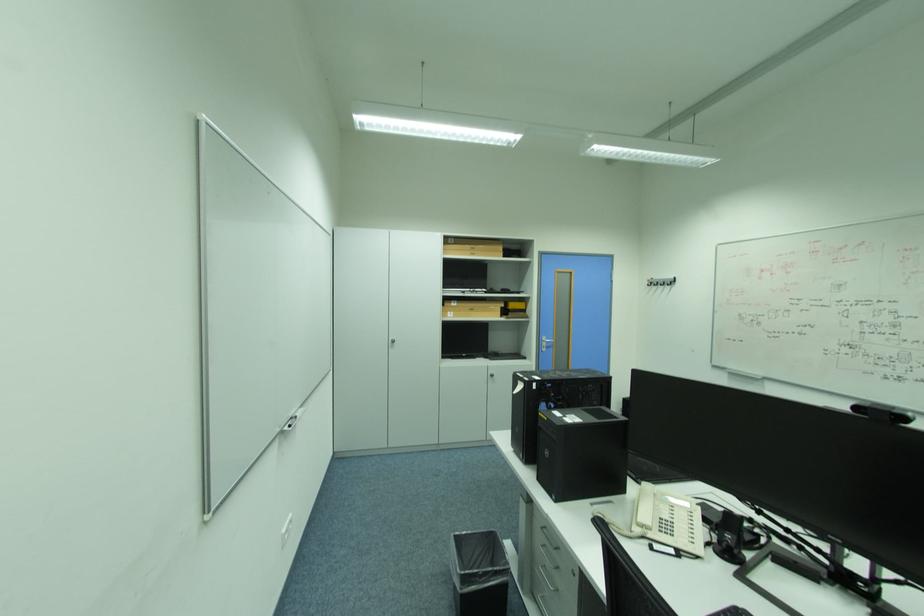
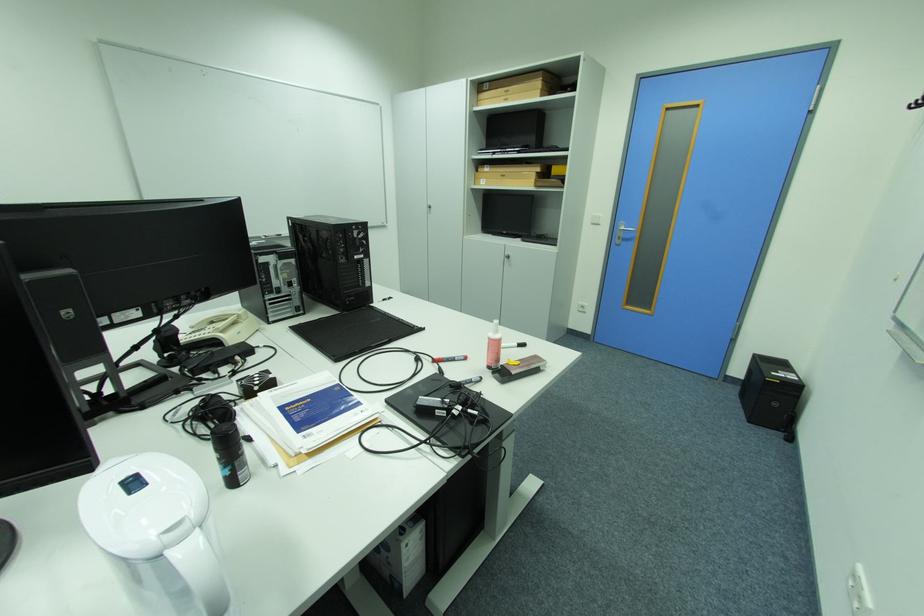
The point at (480, 254) is marked in the first image. Where is the corresponding point in the second image?

(514, 100)